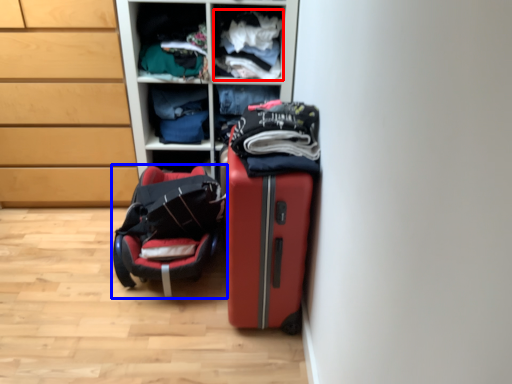
Question: Which point is closer to the camera, clothing (highlighted by a red box) or luggage and bags (highlighted by a blue box)?

Choices:
 (A) clothing
 (B) luggage and bags

Answer: (B)